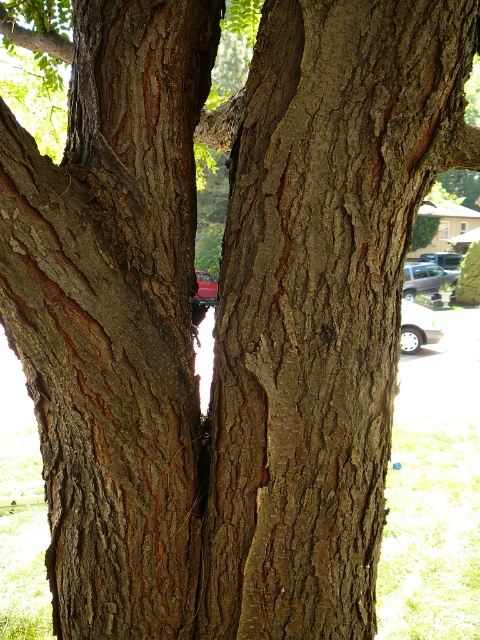
You are standing in front of the two cars in the image. Which car, the silver metallic car at center or the metallic red car at center, is positioned higher up from your viewpoint?

The silver metallic car at center is located above the metallic red car at center, so it is positioned higher up from your viewpoint.

From the picture: You are a delivery person trying to park your van between the silver metallic car at center and the metallic red car at center. The van is 15 feet long. Based on the scene, can you fit your van between them?

The distance between the silver metallic car at center and the metallic red car at center is 8.21 feet. Since the van is 15 feet long, which is longer than the available space, the van cannot fit between them.

You are a delivery person trying to park your 5.5 feet wide delivery van between the silver metallic car at right and the metallic silver car at center. Can you fit your van in the space between them?

The space between the silver metallic car at right and the metallic silver car at center is 4.35 feet. Since your delivery van is 5.5 feet wide, it cannot fit in the available space.